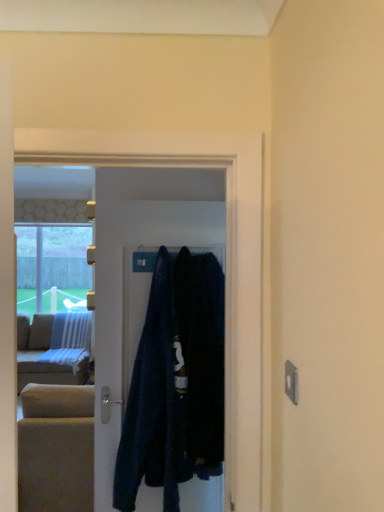
Question: Can you confirm if dark blue fabric at center, the 2th clothing in the right-to-left sequence, is thinner than dark blue fabric at center?

Choices:
 (A) yes
 (B) no

Answer: (B)

Question: Can you confirm if dark blue fabric at center, the 2th clothing in the right-to-left sequence, is wider than dark blue fabric at center?

Choices:
 (A) yes
 (B) no

Answer: (A)

Question: Considering the relative sizes of dark blue fabric at center, the 2th clothing in the right-to-left sequence, and dark blue fabric at center in the image provided, is dark blue fabric at center, the 2th clothing in the right-to-left sequence, smaller than dark blue fabric at center?

Choices:
 (A) yes
 (B) no

Answer: (B)

Question: Is dark blue fabric at center, the 2th clothing in the right-to-left sequence, with dark blue fabric at center?

Choices:
 (A) no
 (B) yes

Answer: (A)

Question: From a real-world perspective, does dark blue fabric at center, the 2th clothing in the right-to-left sequence, sit lower than dark blue fabric at center?

Choices:
 (A) yes
 (B) no

Answer: (A)

Question: From the image's perspective, relative to dark blue fabric at center, the 1th clothing viewed from the left, is dark blue fabric at center above or below?

Choices:
 (A) above
 (B) below

Answer: (A)

Question: In terms of width, does dark blue fabric at center look wider or thinner when compared to dark blue fabric at center, the 1th clothing viewed from the left?

Choices:
 (A) thin
 (B) wide

Answer: (A)

Question: From a real-world perspective, relative to dark blue fabric at center, the 2th clothing in the right-to-left sequence, is dark blue fabric at center vertically above or below?

Choices:
 (A) below
 (B) above

Answer: (B)

Question: Is dark blue fabric at center taller or shorter than dark blue fabric at center, the 1th clothing viewed from the left?

Choices:
 (A) tall
 (B) short

Answer: (A)

Question: From the image's perspective, relative to dark blue fabric coat at center, positioned as the 2th clothing in left-to-right order, is dark blue fabric at center, the 2th clothing in the right-to-left sequence, above or below?

Choices:
 (A) above
 (B) below

Answer: (B)

Question: From a real-world perspective, is dark blue fabric at center, the 2th clothing in the right-to-left sequence, above or below dark blue fabric coat at center, positioned as the 2th clothing in left-to-right order?

Choices:
 (A) above
 (B) below

Answer: (B)

Question: Based on their sizes in the image, would you say dark blue fabric at center, the 1th clothing viewed from the left, is bigger or smaller than dark blue fabric coat at center, positioned as the 2th clothing in left-to-right order?

Choices:
 (A) small
 (B) big

Answer: (A)

Question: Do you think dark blue fabric at center, the 2th clothing in the right-to-left sequence, is within dark blue fabric coat at center, positioned as the 2th clothing in left-to-right order, or outside of it?

Choices:
 (A) outside
 (B) inside

Answer: (A)

Question: Considering the positions of dark blue fabric at center, the 1th clothing viewed from the left, and dark blue fabric at center in the image, is dark blue fabric at center, the 1th clothing viewed from the left, wider or thinner than dark blue fabric at center?

Choices:
 (A) thin
 (B) wide

Answer: (B)

Question: From the image's perspective, is dark blue fabric at center, the 1th clothing viewed from the left, above or below dark blue fabric at center?

Choices:
 (A) above
 (B) below

Answer: (B)